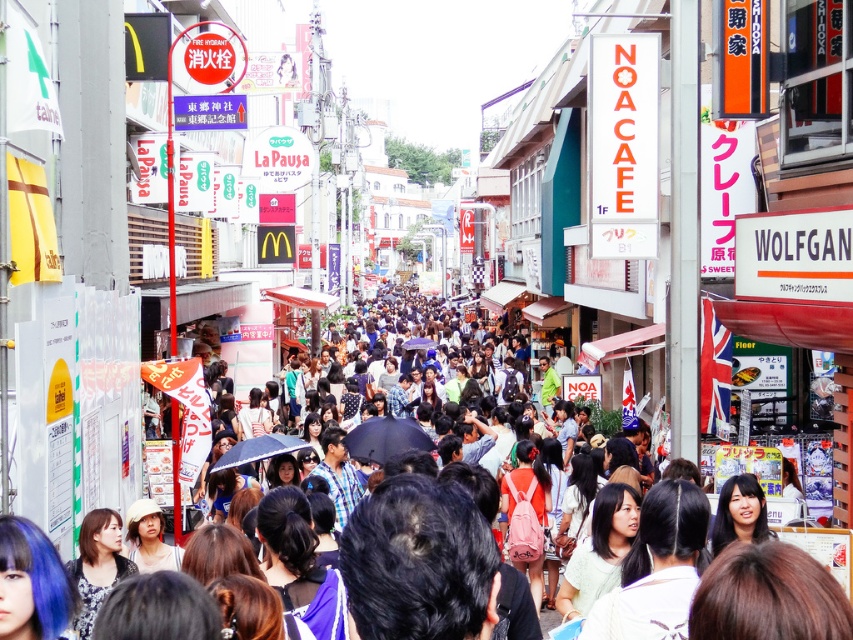
Question: Which point is closer to the camera taking this photo?

Choices:
 (A) (97, 472)
 (B) (231, 449)

Answer: (A)

Question: Does matte black umbrella at center appear under transparent blue umbrella at center?

Choices:
 (A) no
 (B) yes

Answer: (A)

Question: Does black matte umbrella at center appear on the left side of transparent blue umbrella at center?

Choices:
 (A) yes
 (B) no

Answer: (B)

Question: Among these objects, which one is nearest to the camera?

Choices:
 (A) matte black umbrella at center
 (B) black matte umbrella at center

Answer: (A)

Question: Is black matte umbrella at center below transparent blue umbrella at center?

Choices:
 (A) yes
 (B) no

Answer: (B)

Question: Among these objects, which one is nearest to the camera?

Choices:
 (A) transparent blue umbrella at center
 (B) matte black umbrella at center

Answer: (B)